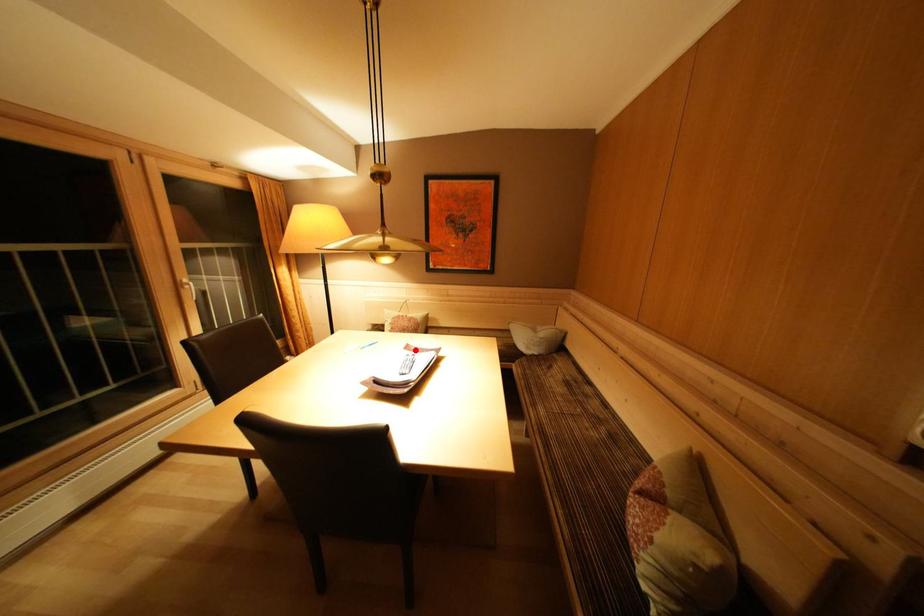
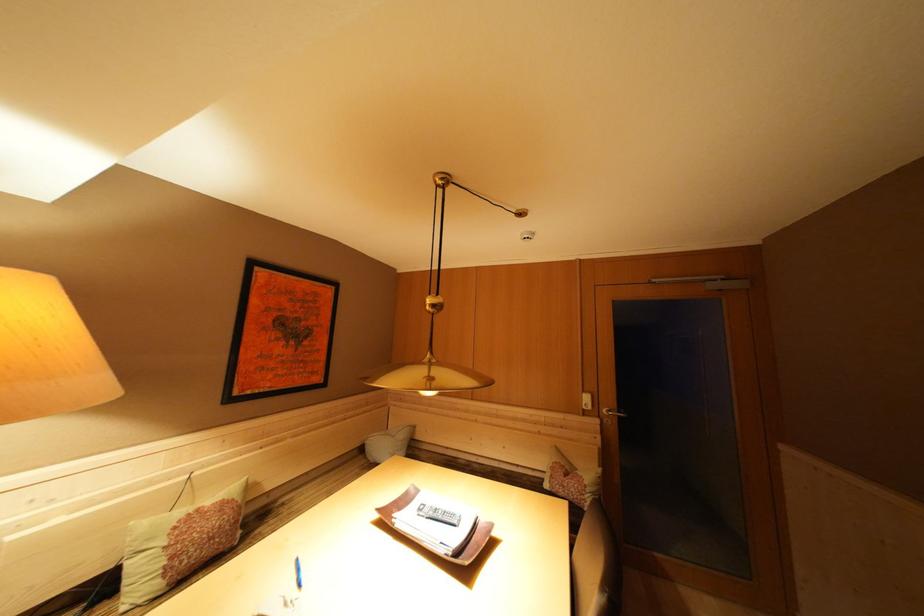
Find the pixel in the second image that matches the highlighted location in the first image.

(384, 515)